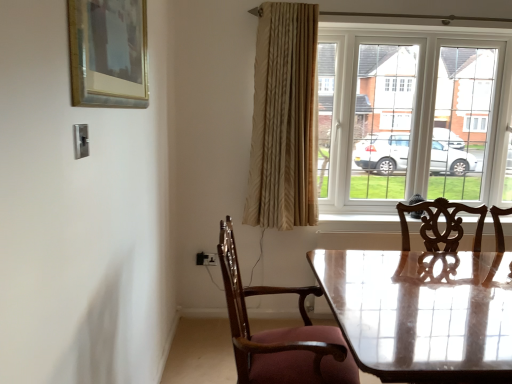
Question: Can you confirm if gold-framed painting at upper left is thinner than white glass window at upper right?

Choices:
 (A) yes
 (B) no

Answer: (A)

Question: From the image's perspective, does gold-framed painting at upper left appear higher than white glass window at upper right?

Choices:
 (A) no
 (B) yes

Answer: (B)

Question: Is gold-framed painting at upper left completely or partially outside of white glass window at upper right?

Choices:
 (A) no
 (B) yes

Answer: (B)

Question: Is gold-framed painting at upper left positioned in front of white glass window at upper right?

Choices:
 (A) yes
 (B) no

Answer: (A)

Question: Does gold-framed painting at upper left have a smaller size compared to white glass window at upper right?

Choices:
 (A) no
 (B) yes

Answer: (B)

Question: From a real-world perspective, is gold-framed painting at upper left located beneath white glass window at upper right?

Choices:
 (A) yes
 (B) no

Answer: (B)

Question: Can we say wooden chair with upholstered seat at lower center lies outside white glass window at upper right?

Choices:
 (A) no
 (B) yes

Answer: (B)

Question: Is wooden chair with upholstered seat at lower center aimed at white glass window at upper right?

Choices:
 (A) no
 (B) yes

Answer: (A)

Question: Can you confirm if wooden chair with upholstered seat at lower center is positioned to the right of white glass window at upper right?

Choices:
 (A) no
 (B) yes

Answer: (A)

Question: Does wooden chair with upholstered seat at lower center have a larger size compared to white glass window at upper right?

Choices:
 (A) yes
 (B) no

Answer: (B)

Question: From a real-world perspective, is wooden chair with upholstered seat at lower center below white glass window at upper right?

Choices:
 (A) yes
 (B) no

Answer: (A)

Question: Is wooden chair with upholstered seat at lower center oriented away from white glass window at upper right?

Choices:
 (A) yes
 (B) no

Answer: (B)

Question: Is beige textured curtain at upper right oriented away from glossy wooden table at center?

Choices:
 (A) yes
 (B) no

Answer: (B)